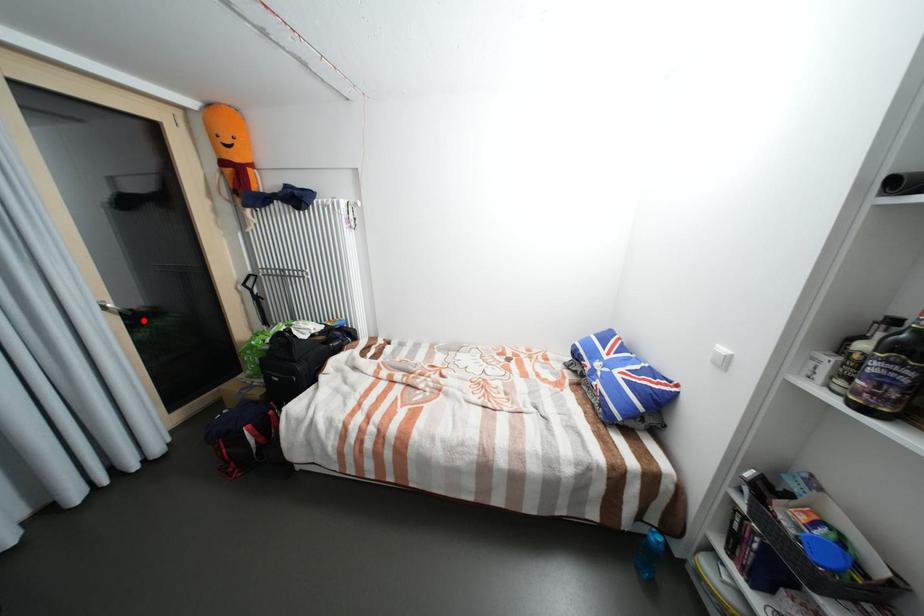
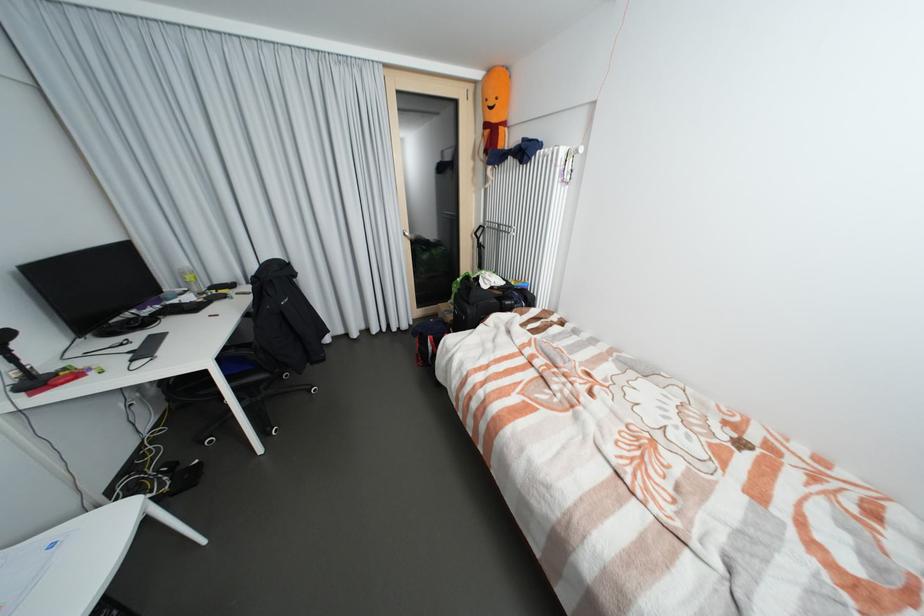
Where in the second image is the point corresponding to the highlighted location from the first image?

(426, 246)